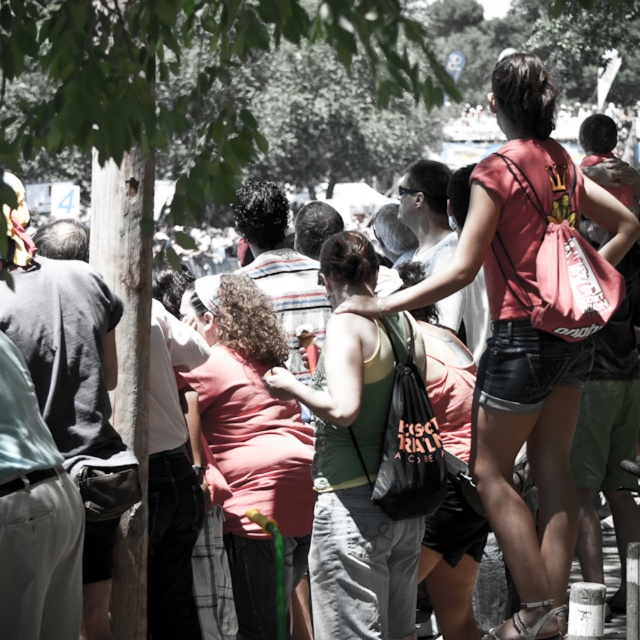
Is point (356, 452) positioned in front of point (285, 442)?

That is True.

You are a GUI agent. You are given a task and a screenshot of the screen. Output one action in this format:
    pyautogui.click(x=<x>, y=<y>)
    Task: Click on the green fabric tank top at center
    
    Given the screenshot: What is the action you would take?
    pyautogui.click(x=355, y=483)